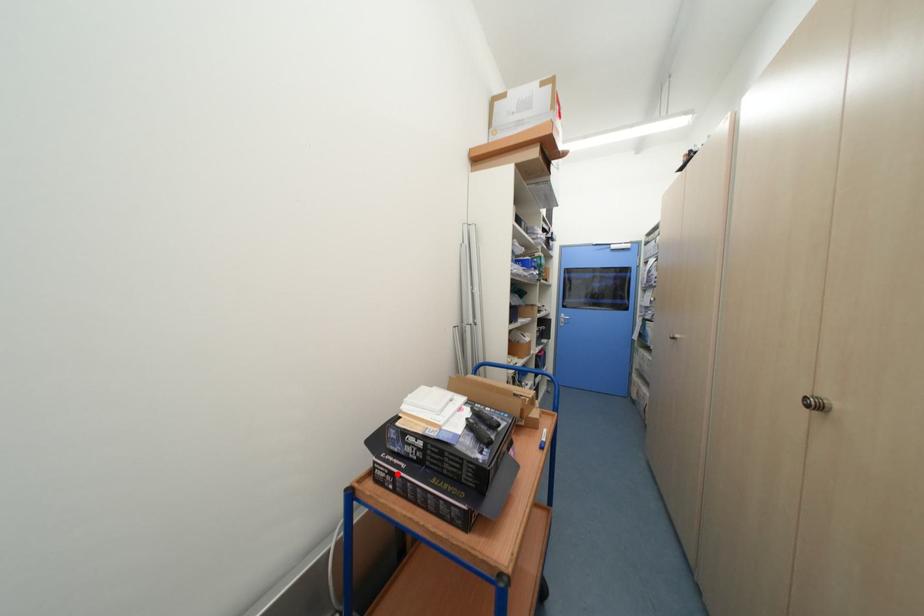
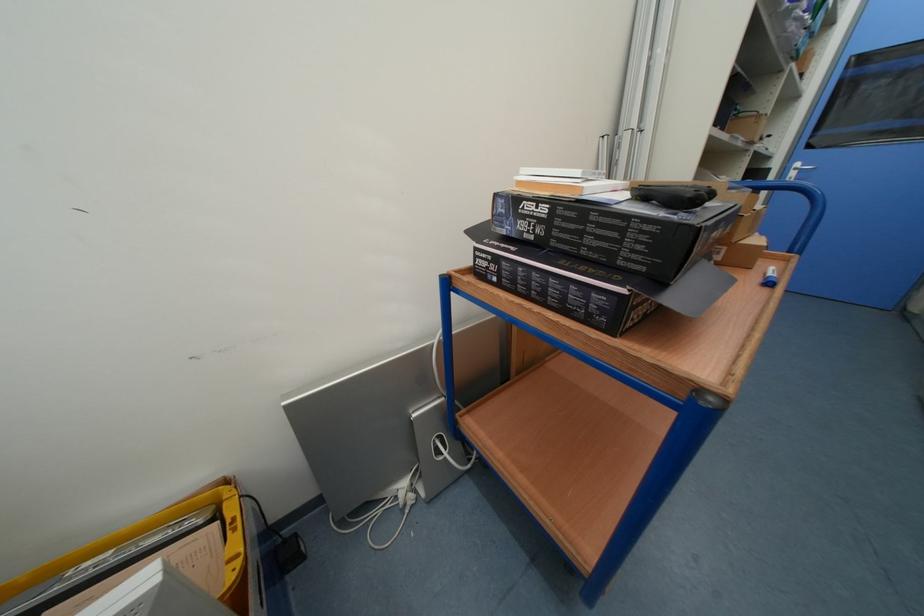
Locate, in the second image, the point that corresponds to the highlighted location in the first image.

(502, 261)